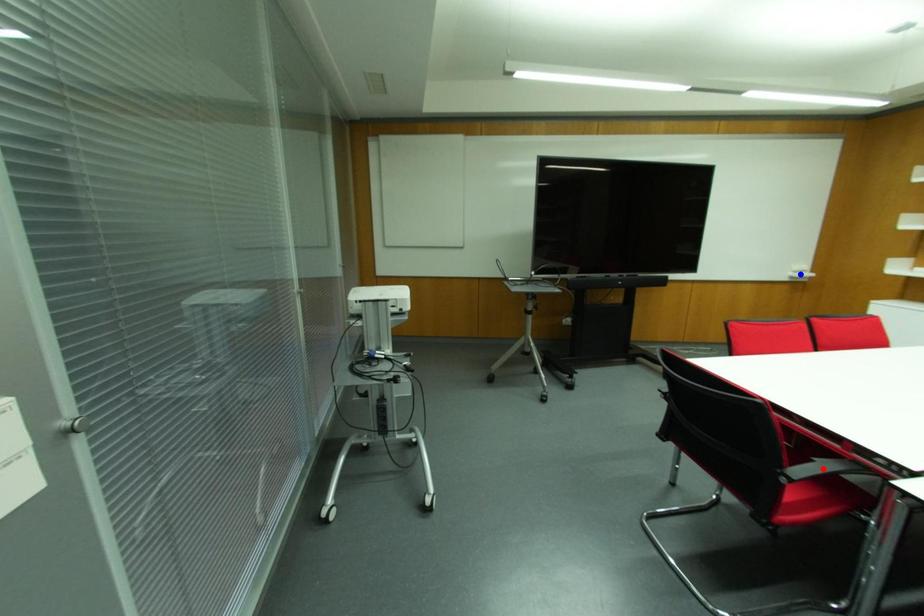
Question: Which of the two points in the image is closer to the camera?

Choices:
 (A) Blue point is closer.
 (B) Red point is closer.

Answer: (B)